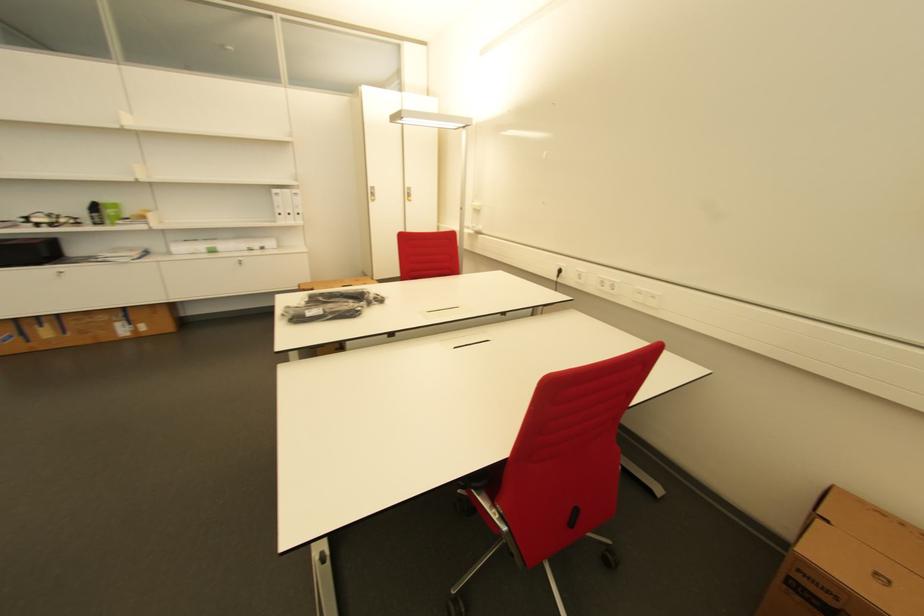
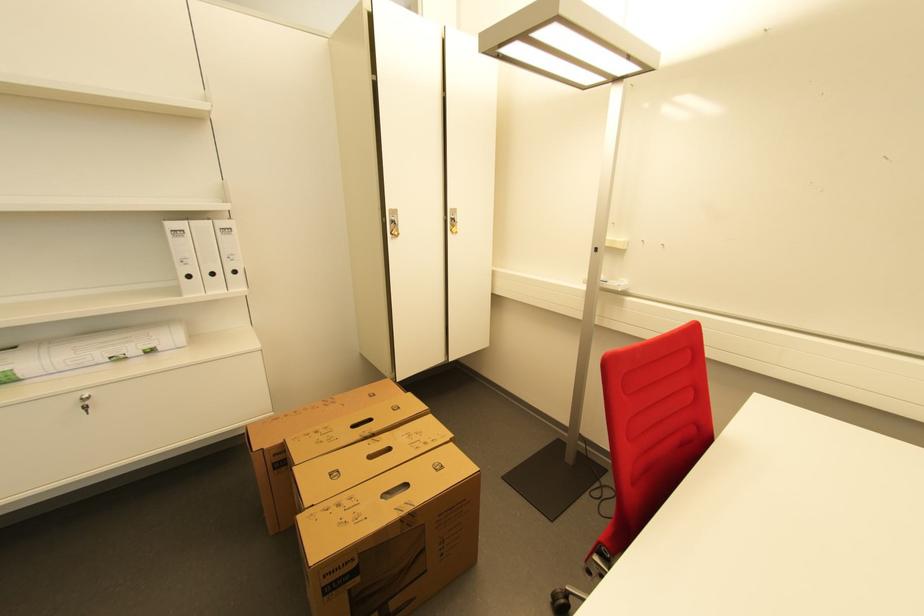
Where in the second image is the point corresponding to the point at 304,215 from the first image?

(239, 273)